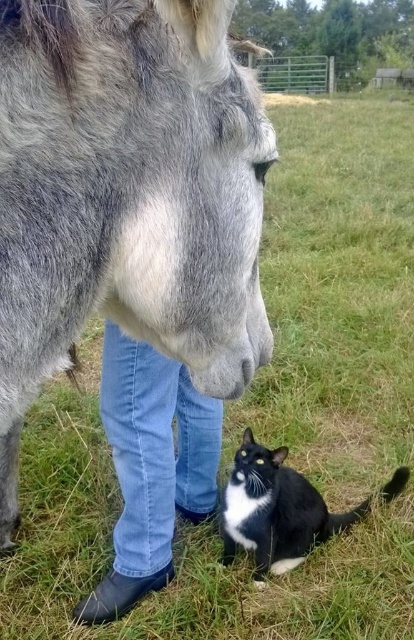
Which of these two, blue jeans at lower center or black glossy fur cat at lower right, stands taller?

blue jeans at lower center

Does blue jeans at lower center have a lesser width compared to black glossy fur cat at lower right?

Indeed, blue jeans at lower center has a lesser width compared to black glossy fur cat at lower right.

The image size is (414, 640). What are the coordinates of `blue jeans at lower center` in the screenshot? It's located at (151, 467).

You are a GUI agent. You are given a task and a screenshot of the screen. Output one action in this format:
    pyautogui.click(x=<x>, y=<y>)
    Task: Click on the blue jeans at lower center
    
    Given the screenshot: What is the action you would take?
    pyautogui.click(x=151, y=467)